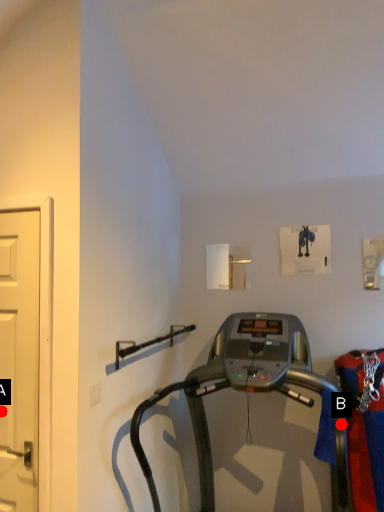
Question: Two points are circled on the image, labeled by A and B beside each circle. Among these points, which one is nearest to the camera?

Choices:
 (A) A is closer
 (B) B is closer

Answer: (A)